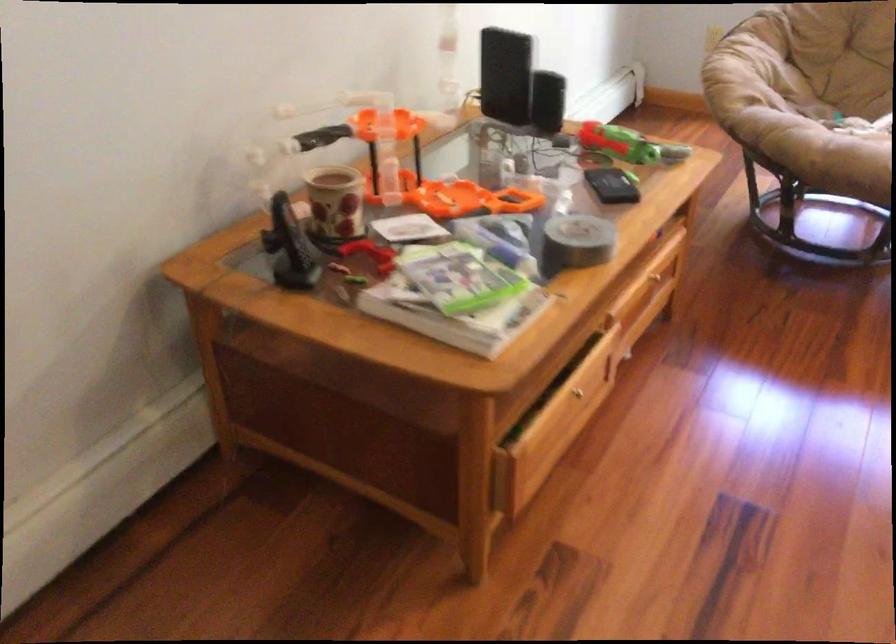
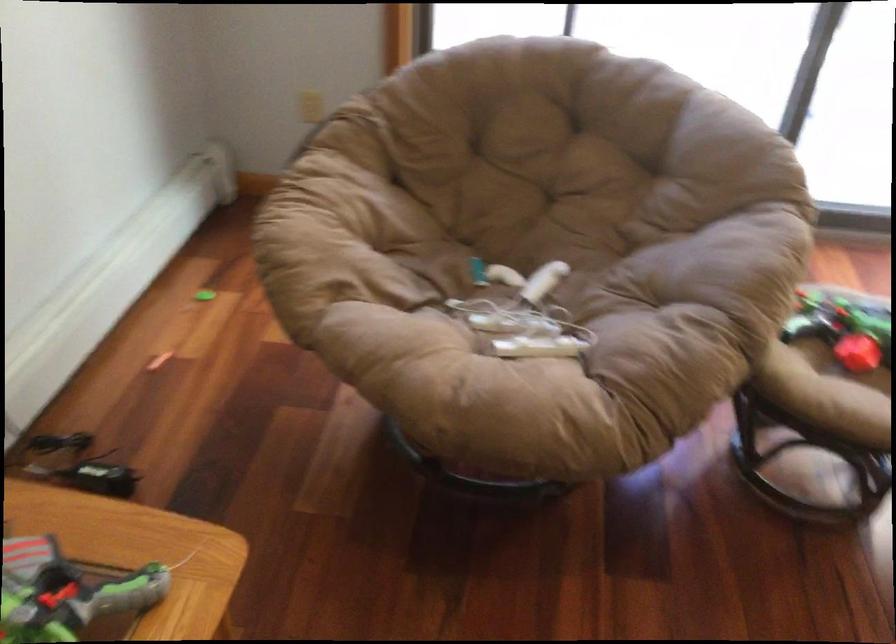
What movement of the cameraman would produce the second image?

The cameraman moved toward right, forward.